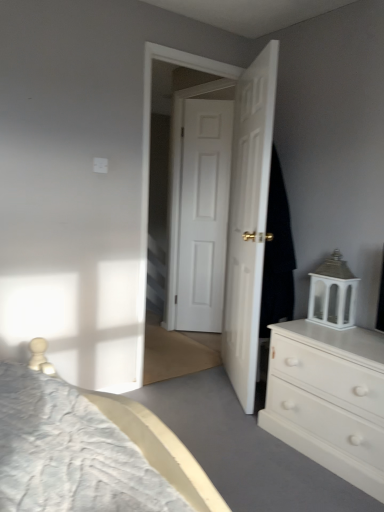
Question: Is white matte door at center, placed as the 1th door when sorted from back to front, in contact with white wooden door at center?

Choices:
 (A) no
 (B) yes

Answer: (A)

Question: Considering the relative positions of white matte door at center, marked as the 2th door in a front-to-back arrangement, and white wooden door at center in the image provided, is white matte door at center, marked as the 2th door in a front-to-back arrangement, to the left of white wooden door at center from the viewer's perspective?

Choices:
 (A) no
 (B) yes

Answer: (A)

Question: Is white matte door at center, marked as the 2th door in a front-to-back arrangement, outside white wooden door at center?

Choices:
 (A) no
 (B) yes

Answer: (B)

Question: Is white matte door at center, placed as the 1th door when sorted from back to front, wider than white wooden door at center?

Choices:
 (A) yes
 (B) no

Answer: (B)

Question: Is white matte door at center, placed as the 1th door when sorted from back to front, looking in the opposite direction of white wooden door at center?

Choices:
 (A) no
 (B) yes

Answer: (B)

Question: Is white matte door at center, placed as the 1th door when sorted from back to front, positioned in front of white wooden door at center?

Choices:
 (A) no
 (B) yes

Answer: (A)

Question: Considering the relative sizes of white matte chest of drawers at right and white wooden door at center in the image provided, is white matte chest of drawers at right wider than white wooden door at center?

Choices:
 (A) yes
 (B) no

Answer: (A)

Question: Is white matte chest of drawers at right aimed at white wooden door at center?

Choices:
 (A) yes
 (B) no

Answer: (B)

Question: Can you confirm if white matte chest of drawers at right is taller than white wooden door at center?

Choices:
 (A) yes
 (B) no

Answer: (B)

Question: Is white matte chest of drawers at right next to white wooden door at center?

Choices:
 (A) no
 (B) yes

Answer: (A)

Question: Is white matte chest of drawers at right at the right side of white wooden door at center?

Choices:
 (A) yes
 (B) no

Answer: (A)

Question: From the image's perspective, is white matte chest of drawers at right below white wooden door at center?

Choices:
 (A) yes
 (B) no

Answer: (A)

Question: From a real-world perspective, is white matte chest of drawers at right positioned under black fabric at right based on gravity?

Choices:
 (A) no
 (B) yes

Answer: (B)